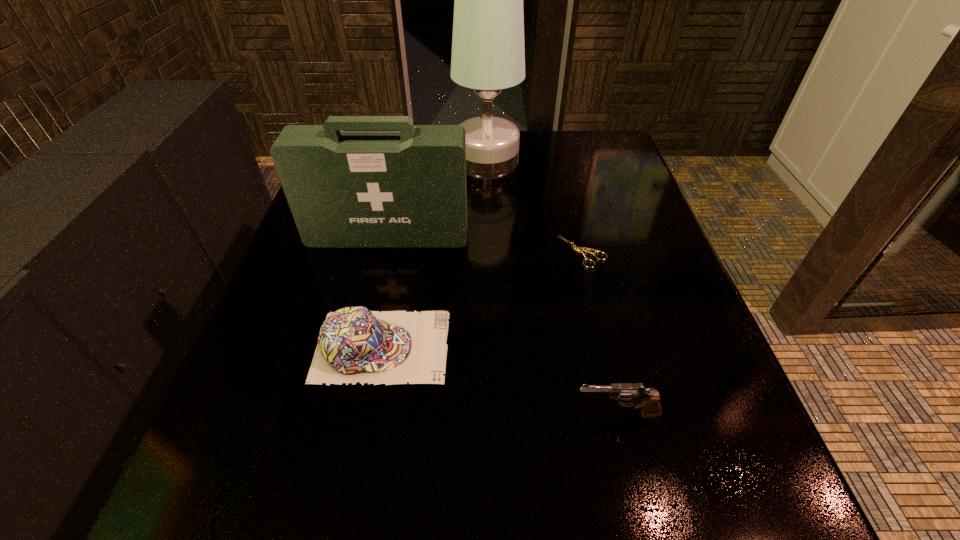
This screenshot has height=540, width=960. Identify the location of vacant space at the far edge of the desktop. (516, 170).

You are a GUI agent. You are given a task and a screenshot of the screen. Output one action in this format:
    pyautogui.click(x=<x>, y=<y>)
    Task: Click on the free space at the left edge of the desktop
    The image size is (960, 540).
    Given the screenshot: What is the action you would take?
    pyautogui.click(x=250, y=416)

This screenshot has width=960, height=540. I want to click on free space at the right edge, so click(x=611, y=220).

Where is `free spot at the near left corner of the desktop`? Image resolution: width=960 pixels, height=540 pixels. free spot at the near left corner of the desktop is located at coordinates [299, 506].

You are a GUI agent. You are given a task and a screenshot of the screen. Output one action in this format:
    pyautogui.click(x=<x>, y=<y>)
    Task: Click on the free space between the cap and the shortest object
    
    Given the screenshot: What is the action you would take?
    pyautogui.click(x=482, y=299)

This screenshot has width=960, height=540. Find the location of `free point between the shortest object and the pistol`. free point between the shortest object and the pistol is located at coordinates (599, 333).

Where is `vacant area that lies between the nearest object and the tallest object`? vacant area that lies between the nearest object and the tallest object is located at coordinates (552, 281).

Locate an element on the screen. This screenshot has height=540, width=960. empty space between the shortest object and the fourth farthest object is located at coordinates (482, 299).

The width and height of the screenshot is (960, 540). I want to click on vacant point located between the fourth farthest object and the shortest object, so click(x=482, y=299).

At what (x,y) coordinates should I click in order to perform the action: click on vacant area that lies between the cap and the pistol. Please return your answer as a coordinate pair (x, y). The image size is (960, 540). Looking at the image, I should click on (499, 381).